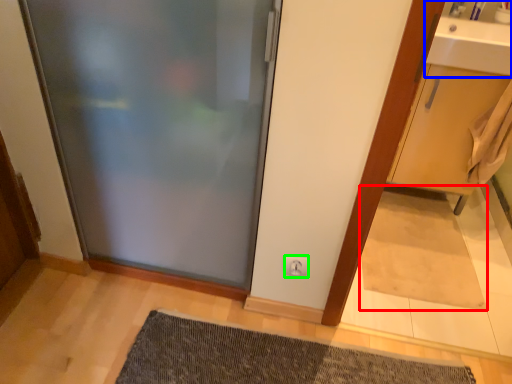
Question: Which object is positioned closest to doormat (highlighted by a red box)? Select from sink (highlighted by a blue box) and electric outlet (highlighted by a green box).

Choices:
 (A) sink
 (B) electric outlet

Answer: (B)